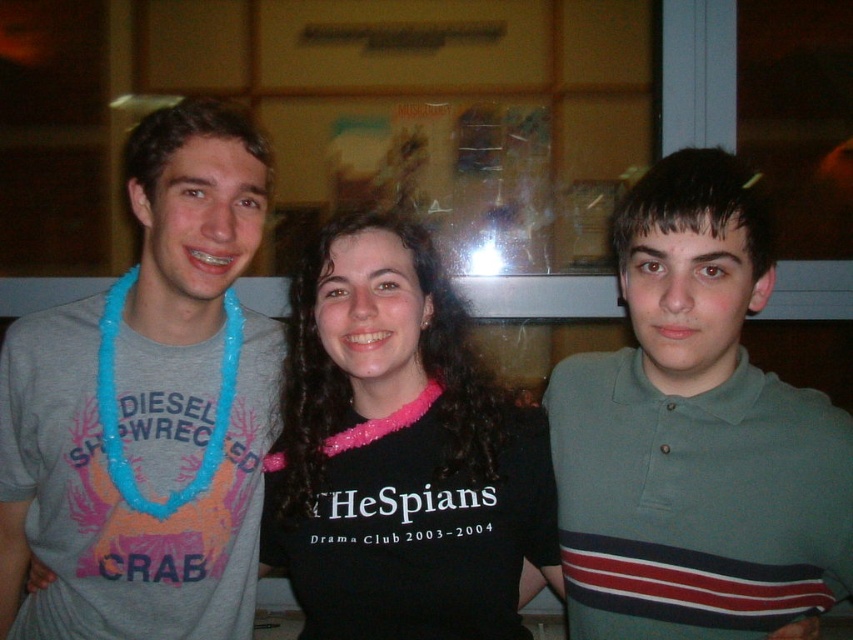
Which is more to the left, gray fabric neck at center or pink fabric necklace at center?

pink fabric necklace at center is more to the left.

Does gray fabric neck at center appear on the right side of pink fabric necklace at center?

Yes, gray fabric neck at center is to the right of pink fabric necklace at center.

Is point (722, 368) positioned before point (368, 349)?

No, it is behind (368, 349).

You are a GUI agent. You are given a task and a screenshot of the screen. Output one action in this format:
    pyautogui.click(x=<x>, y=<y>)
    Task: Click on the gray fabric neck at center
    
    Given the screenshot: What is the action you would take?
    pyautogui.click(x=688, y=360)

Between blue beaded necklace at left and pink fabric necklace at center, which one appears on the left side from the viewer's perspective?

From the viewer's perspective, blue beaded necklace at left appears more on the left side.

Is point (198, 291) positioned before point (413, 380)?

No, (198, 291) is further to viewer.

Where is `blue beaded necklace at left`? The width and height of the screenshot is (853, 640). blue beaded necklace at left is located at coordinates (178, 292).

Who is higher up, green polo shirt at center or blue beaded necklace at left?

blue beaded necklace at left

Identify the location of green polo shirt at center. The image size is (853, 640). (695, 440).

Find the location of a particular element. The image size is (853, 640). green polo shirt at center is located at coordinates (x=695, y=440).